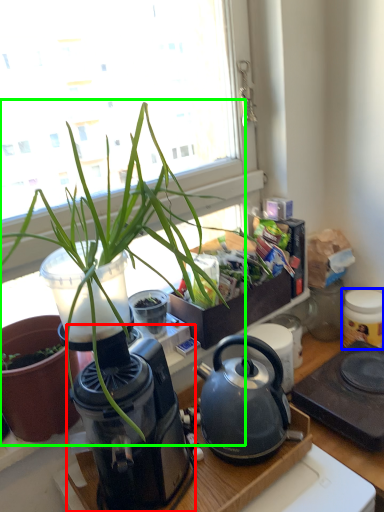
Question: Considering the real-world distances, which object is closest to coffee machine (highlighted by a red box)? appliance (highlighted by a blue box) or houseplant (highlighted by a green box).

Choices:
 (A) appliance
 (B) houseplant

Answer: (B)